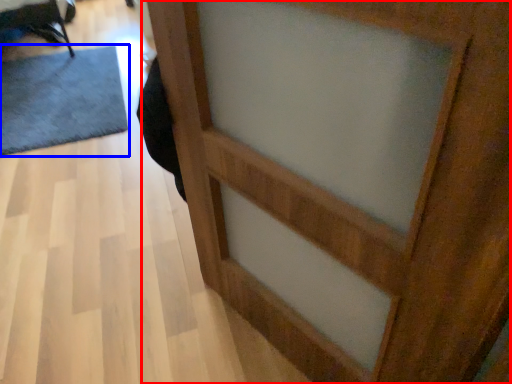
Question: Which point is closer to the camera, barn door (highlighted by a red box) or doormat (highlighted by a blue box)?

Choices:
 (A) barn door
 (B) doormat

Answer: (A)